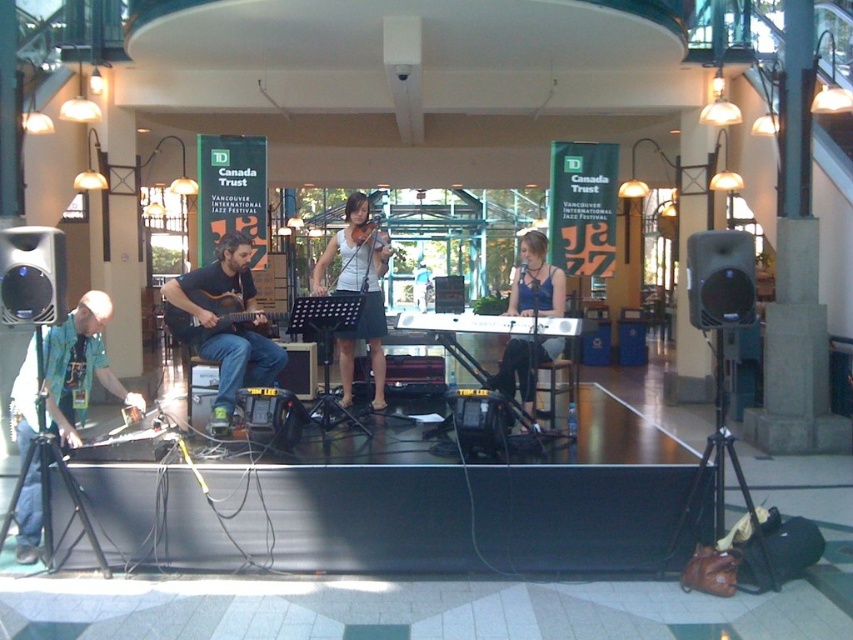
Does green fabric shirt at left have a lesser height compared to acoustic wood guitar at center?

In fact, green fabric shirt at left may be taller than acoustic wood guitar at center.

Who is more forward, (27, 532) or (173, 332)?

Point (27, 532) is more forward.

What do you see at coordinates (78, 368) in the screenshot?
I see `green fabric shirt at left` at bounding box center [78, 368].

You are a GUI agent. You are given a task and a screenshot of the screen. Output one action in this format:
    pyautogui.click(x=<x>, y=<y>)
    Task: Click on the green fabric shirt at left
    
    Given the screenshot: What is the action you would take?
    pyautogui.click(x=78, y=368)

Is matte black guitar at left below white fabric skirt at center?

Yes, matte black guitar at left is below white fabric skirt at center.

Which is above, matte black guitar at left or white fabric skirt at center?

white fabric skirt at center

Does point (219, 404) come in front of point (381, 323)?

Yes, it is.

Identify the location of matte black guitar at left. This screenshot has height=640, width=853. (223, 323).

What do you see at coordinates (357, 291) in the screenshot? The image size is (853, 640). I see `white fabric skirt at center` at bounding box center [357, 291].

Does white fabric skirt at center have a smaller size compared to acoustic wood guitar at center?

Yes, white fabric skirt at center is smaller than acoustic wood guitar at center.

Is point (379, 253) behind point (173, 326)?

Yes, point (379, 253) is farther from viewer.

At what (x,y) coordinates should I click in order to perform the action: click on white fabric skirt at center. Please return your answer as a coordinate pair (x, y). Image resolution: width=853 pixels, height=640 pixels. Looking at the image, I should click on (357, 291).